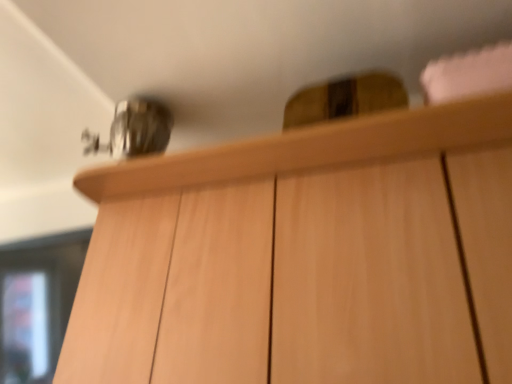
In order to face light wood cabinet at upper center, should I rotate leftwards or rightwards?

To face it directly, rotate right by 2.893 degrees.

Describe the element at coordinates (305, 256) in the screenshot. I see `light wood cabinet at upper center` at that location.

Identify the location of light wood cabinet at upper center. (305, 256).

Measure the distance between light wood cabinet at upper center and camera.

light wood cabinet at upper center and camera are 28.31 inches apart.

Describe the element at coordinates (37, 303) in the screenshot. I see `transparent glass door at lower left` at that location.

In order to click on transparent glass door at lower left in this screenshot , I will do `click(37, 303)`.

Where is `light wood cabinet at upper center`? The image size is (512, 384). light wood cabinet at upper center is located at coordinates (305, 256).

Would you say transparent glass door at lower left is to the left or to the right of light wood cabinet at upper center in the picture?

From the image, it's evident that transparent glass door at lower left is to the left of light wood cabinet at upper center.

Considering the relative positions of transparent glass door at lower left and light wood cabinet at upper center in the image provided, is transparent glass door at lower left in front of light wood cabinet at upper center?

No, transparent glass door at lower left is further to the viewer.

Which is in front, point (45, 265) or point (487, 116)?

The point (487, 116) is closer to the camera.

From the image's perspective, is transparent glass door at lower left on light wood cabinet at upper center?

Actually, transparent glass door at lower left appears below light wood cabinet at upper center in the image.

From a real-world perspective, does transparent glass door at lower left stand above light wood cabinet at upper center?

No, from a real-world perspective, transparent glass door at lower left is not over light wood cabinet at upper center

Which object is thinner, transparent glass door at lower left or light wood cabinet at upper center?

Thinner between the two is transparent glass door at lower left.

Considering the sizes of transparent glass door at lower left and light wood cabinet at upper center in the image, is transparent glass door at lower left taller or shorter than light wood cabinet at upper center?

In the image, transparent glass door at lower left appears to be shorter than light wood cabinet at upper center.

Can you confirm if transparent glass door at lower left is bigger than light wood cabinet at upper center?

Actually, transparent glass door at lower left might be smaller than light wood cabinet at upper center.

Is transparent glass door at lower left inside or outside of light wood cabinet at upper center?

transparent glass door at lower left lies outside light wood cabinet at upper center.

From the picture: Is there a large distance between transparent glass door at lower left and light wood cabinet at upper center?

Actually, transparent glass door at lower left and light wood cabinet at upper center are a little close together.

Does transparent glass door at lower left turn towards light wood cabinet at upper center?

No, transparent glass door at lower left is not facing towards light wood cabinet at upper center.

What are the coordinates of `glass door lying behind the light wood cabinet at upper center` in the screenshot? It's located at (37, 303).

Considering the relative positions of light wood cabinet at upper center and transparent glass door at lower left in the image provided, is light wood cabinet at upper center to the left of transparent glass door at lower left from the viewer's perspective?

No.

Considering the relative positions of light wood cabinet at upper center and transparent glass door at lower left in the image provided, is light wood cabinet at upper center in front of transparent glass door at lower left?

That is True.

Is point (261, 269) farther from camera compared to point (34, 268)?

No, (261, 269) is closer to viewer.

From the image's perspective, would you say light wood cabinet at upper center is positioned over transparent glass door at lower left?

Yes, from the image's perspective, light wood cabinet at upper center is above transparent glass door at lower left.

From a real-world perspective, is light wood cabinet at upper center physically below transparent glass door at lower left?

No, from a real-world perspective, light wood cabinet at upper center is not below transparent glass door at lower left.

Is light wood cabinet at upper center thinner than transparent glass door at lower left?

No, light wood cabinet at upper center is not thinner than transparent glass door at lower left.

In the scene shown: Considering the relative sizes of light wood cabinet at upper center and transparent glass door at lower left in the image provided, is light wood cabinet at upper center shorter than transparent glass door at lower left?

No.

Does light wood cabinet at upper center have a smaller size compared to transparent glass door at lower left?

Actually, light wood cabinet at upper center might be larger than transparent glass door at lower left.

Is light wood cabinet at upper center spatially inside transparent glass door at lower left, or outside of it?

light wood cabinet at upper center lies outside transparent glass door at lower left.

Is light wood cabinet at upper center not near transparent glass door at lower left?

Actually, light wood cabinet at upper center and transparent glass door at lower left are a little close together.

Is light wood cabinet at upper center positioned with its back to transparent glass door at lower left?

light wood cabinet at upper center is not turned away from transparent glass door at lower left.

How different are the orientations of light wood cabinet at upper center and transparent glass door at lower left in degrees?

0.177 degrees separate the facing orientations of light wood cabinet at upper center and transparent glass door at lower left.

How much distance is there between light wood cabinet at upper center and transparent glass door at lower left?

light wood cabinet at upper center is 25.82 inches away from transparent glass door at lower left.

You are a GUI agent. You are given a task and a screenshot of the screen. Output one action in this format:
    pyautogui.click(x=<x>, y=<y>)
    Task: Click on the glass door to the left of light wood cabinet at upper center
    
    Given the screenshot: What is the action you would take?
    pyautogui.click(x=37, y=303)

Locate an element on the screen. This screenshot has width=512, height=384. glass door behind the light wood cabinet at upper center is located at coordinates tap(37, 303).

Where is `glass door on the left of light wood cabinet at upper center`? The image size is (512, 384). glass door on the left of light wood cabinet at upper center is located at coordinates (37, 303).